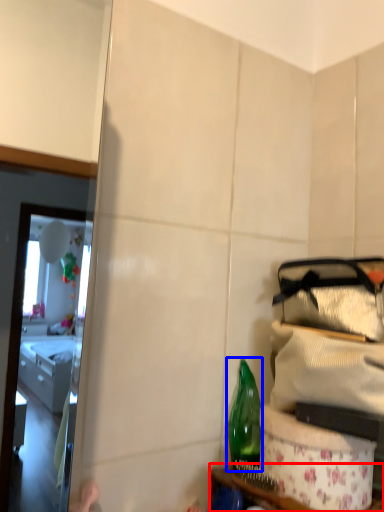
Question: Which object is further to the camera taking this photo, furniture (highlighted by a red box) or bottle (highlighted by a blue box)?

Choices:
 (A) furniture
 (B) bottle

Answer: (B)